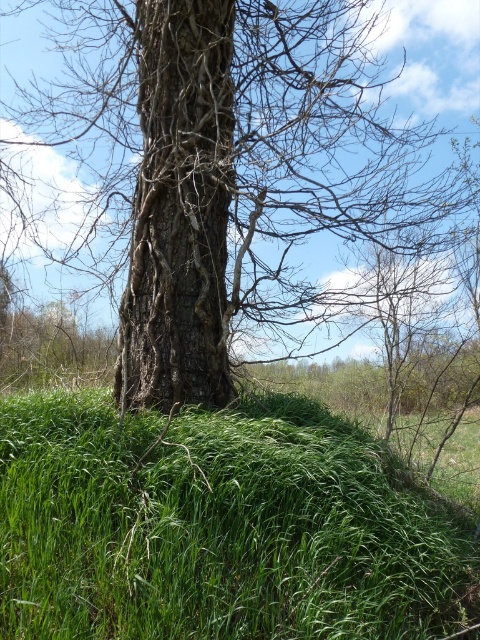
Can you confirm if green grassy mound at lower left is positioned to the left of brown rough bark tree trunk at center?

In fact, green grassy mound at lower left is to the right of brown rough bark tree trunk at center.

Who is shorter, green grassy mound at lower left or brown rough bark tree trunk at center?

With less height is green grassy mound at lower left.

Image resolution: width=480 pixels, height=640 pixels. What are the coordinates of `green grassy mound at lower left` in the screenshot? It's located at [217, 525].

Which is more to the left, smooth bark tree at center or brown rough bark tree trunk at center?

brown rough bark tree trunk at center is more to the left.

Consider the image. Is smooth bark tree at center shorter than brown rough bark tree trunk at center?

No, smooth bark tree at center is not shorter than brown rough bark tree trunk at center.

Find the location of `smooth bark tree at center`. smooth bark tree at center is located at coordinates coord(228,173).

This screenshot has width=480, height=640. Find the location of `smooth bark tree at center`. smooth bark tree at center is located at coordinates (x=228, y=173).

The height and width of the screenshot is (640, 480). What do you see at coordinates (228, 173) in the screenshot? I see `smooth bark tree at center` at bounding box center [228, 173].

Between point (128, 81) and point (60, 540), which one is positioned behind?

Positioned behind is point (128, 81).

At what (x,y) coordinates should I click in order to perform the action: click on smooth bark tree at center. Please return your answer as a coordinate pair (x, y). The height and width of the screenshot is (640, 480). Looking at the image, I should click on (228, 173).